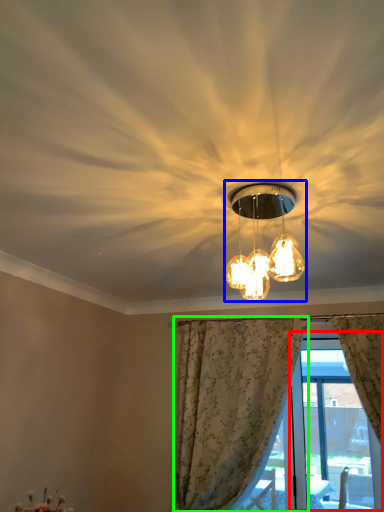
Question: Which is nearer to the window screen (highlighted by a red box)? lamp (highlighted by a blue box) or curtain (highlighted by a green box).

Choices:
 (A) lamp
 (B) curtain

Answer: (B)